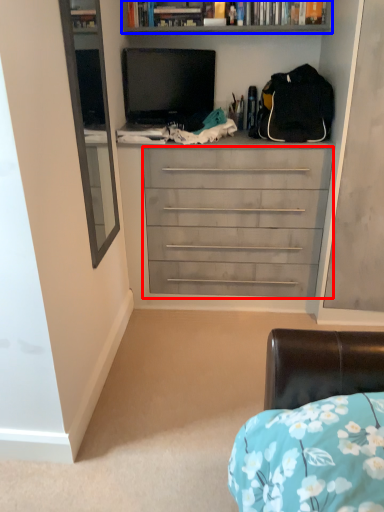
Question: Which object is further to the camera taking this photo, chest of drawers (highlighted by a red box) or bookcase (highlighted by a blue box)?

Choices:
 (A) chest of drawers
 (B) bookcase

Answer: (B)